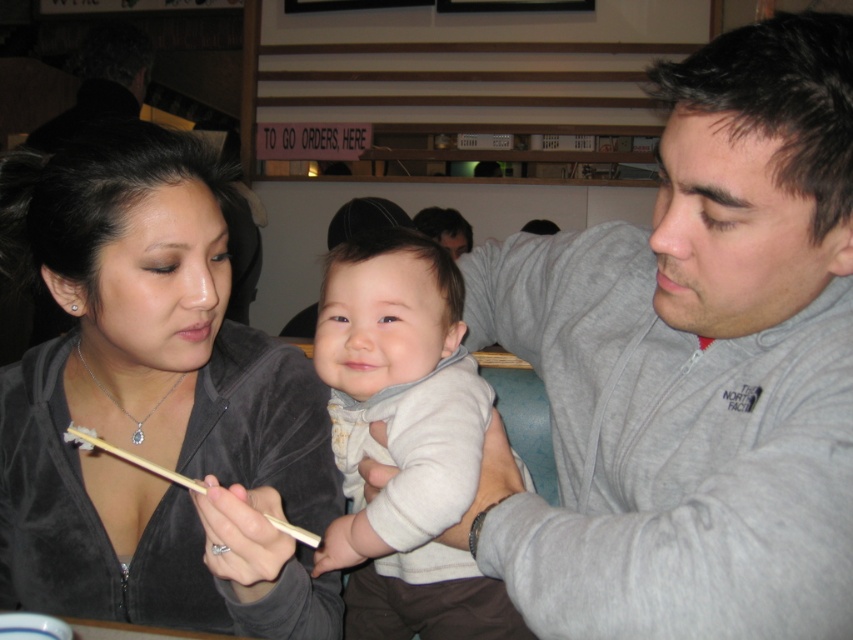
You are a customer in this restaurant and want to borrow a jacket and a sweater to keep warm. The gray fleece jacket at upper right and the light gray soft sweater at center are available. Which one is bigger in size?

The gray fleece jacket at upper right is larger in size than the light gray soft sweater at center, so the gray fleece jacket at upper right is bigger in size.

You are a photographer standing at the camera position. You want to take a closeup shot of the baby without moving the camera. Is the gray fleece jacket at upper right in the way of the camera lens? Please explain.

The gray fleece jacket at upper right is 19.44 inches away from the camera. Since the jacket is positioned at the upper right and the baby is in the foreground, the jacket is likely behind the camera or outside the frame, so it won not block the lens.

You are a waiter in a restaurant and need to place a 30 cm wide dessert plate between the gray fleece jacket at upper right and the wooden chopsticks at lower center. Will there be enough space?

The gray fleece jacket at upper right and wooden chopsticks at lower center are 33.24 centimeters apart, so yes, the dessert plate will fit as the distance between them is greater than the plate width.